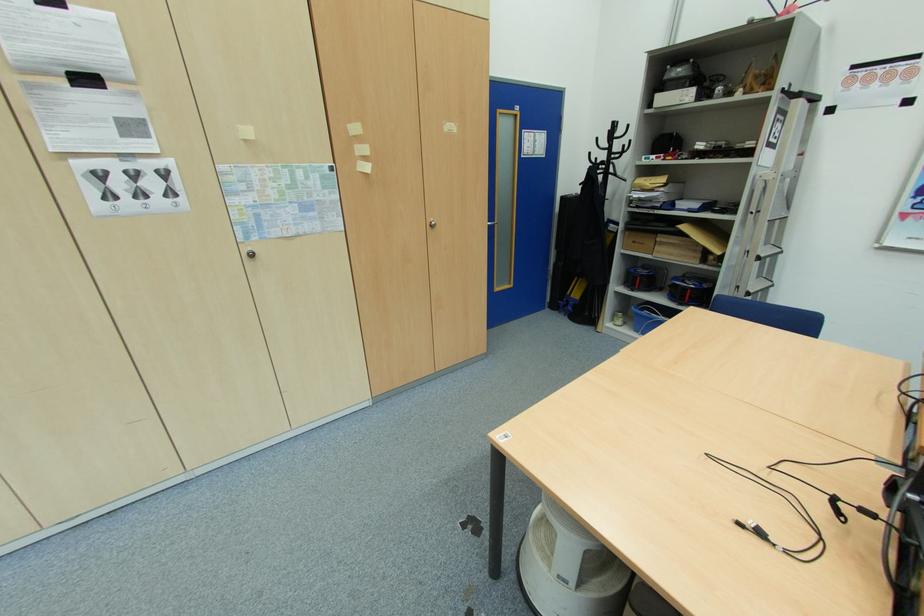
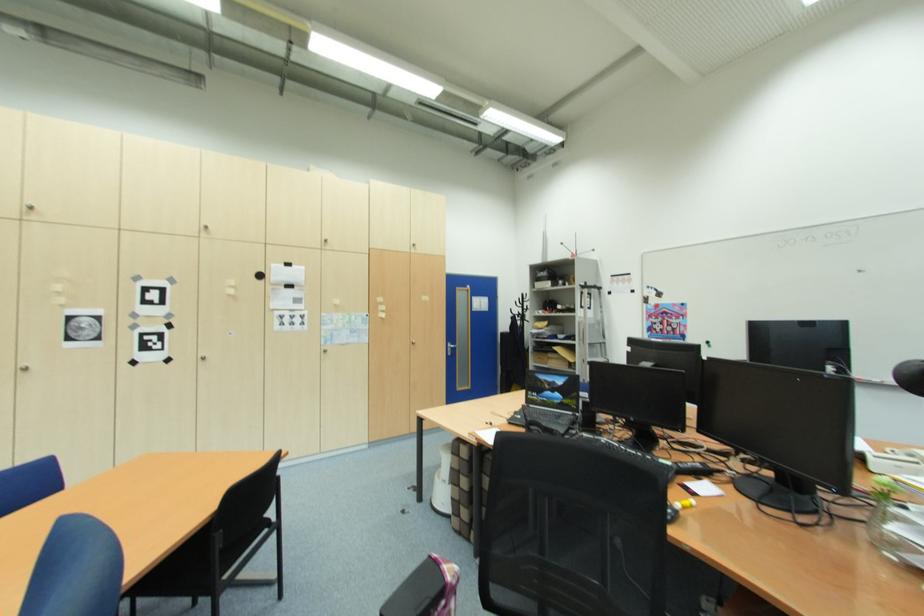
In the second image, find the point that corresponds to pixel 752 166 in the first image.

(578, 317)